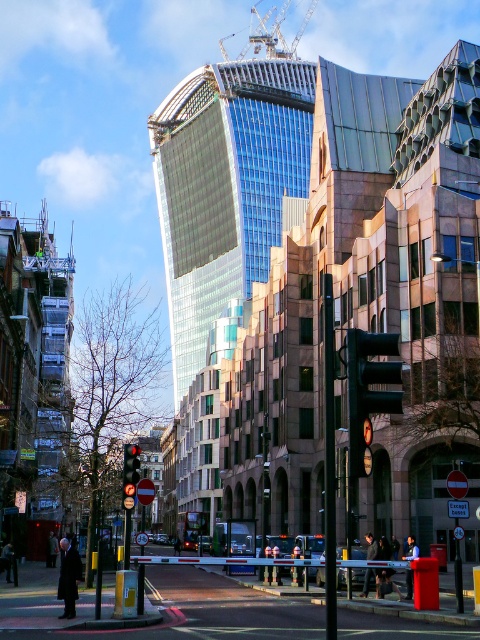
Does green matte traffic light at center have a larger size compared to metallic construction crane at upper center?

Incorrect, green matte traffic light at center is not larger than metallic construction crane at upper center.

Which of these two, green matte traffic light at center or metallic construction crane at upper center, stands taller?

With more height is metallic construction crane at upper center.

Which is in front, point (367, 412) or point (308, 8)?

Point (367, 412) is in front.

Find the location of a particular element. green matte traffic light at center is located at coordinates (369, 392).

Does glassy reflective skyscraper at center come behind green matte traffic light at center?

Yes, glassy reflective skyscraper at center is further from the viewer.

Does glassy reflective skyscraper at center have a larger size compared to green matte traffic light at center?

Correct, glassy reflective skyscraper at center is larger in size than green matte traffic light at center.

Which is in front, point (165, 115) or point (387, 401)?

Point (387, 401)

Identify the location of glassy reflective skyscraper at center. (226, 188).

Who is higher up, metallic construction crane at upper center or red glass traffic light at center?

metallic construction crane at upper center

Is point (308, 13) farther from viewer compared to point (132, 451)?

Yes, point (308, 13) is behind point (132, 451).

Where is `metallic construction crane at upper center`? The width and height of the screenshot is (480, 640). metallic construction crane at upper center is located at coordinates (275, 33).